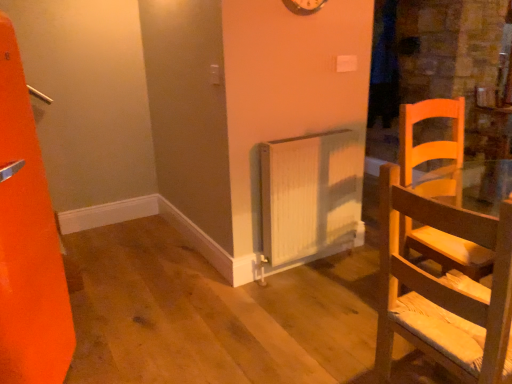
Question: Does white ribbed radiator at center have a lesser height compared to light wood chair at right?

Choices:
 (A) yes
 (B) no

Answer: (A)

Question: Is white ribbed radiator at center bigger than light wood chair at right?

Choices:
 (A) yes
 (B) no

Answer: (B)

Question: Does white ribbed radiator at center appear on the right side of light wood chair at right?

Choices:
 (A) no
 (B) yes

Answer: (A)

Question: Is white ribbed radiator at center not inside light wood chair at right?

Choices:
 (A) no
 (B) yes

Answer: (B)

Question: Can you confirm if white ribbed radiator at center is thinner than light wood chair at right?

Choices:
 (A) no
 (B) yes

Answer: (B)

Question: Is light wood chair at right taller or shorter than white ribbed radiator at center?

Choices:
 (A) short
 (B) tall

Answer: (B)

Question: Does point (493, 342) appear closer or farther from the camera than point (309, 228)?

Choices:
 (A) closer
 (B) farther

Answer: (A)

Question: In terms of width, does light wood chair at right look wider or thinner when compared to white ribbed radiator at center?

Choices:
 (A) thin
 (B) wide

Answer: (B)

Question: From the image's perspective, is light wood chair at right positioned above or below white ribbed radiator at center?

Choices:
 (A) below
 (B) above

Answer: (A)

Question: Is metallic silver clock at upper center taller or shorter than light wood chair at right?

Choices:
 (A) short
 (B) tall

Answer: (A)

Question: From the image's perspective, relative to light wood chair at right, is metallic silver clock at upper center above or below?

Choices:
 (A) above
 (B) below

Answer: (A)

Question: Is metallic silver clock at upper center wider or thinner than light wood chair at right?

Choices:
 (A) thin
 (B) wide

Answer: (A)

Question: Is metallic silver clock at upper center in front of or behind light wood chair at right in the image?

Choices:
 (A) front
 (B) behind

Answer: (B)

Question: In terms of width, does white ribbed radiator at center look wider or thinner when compared to metallic silver clock at upper center?

Choices:
 (A) wide
 (B) thin

Answer: (A)

Question: From a real-world perspective, is white ribbed radiator at center positioned above or below metallic silver clock at upper center?

Choices:
 (A) above
 (B) below

Answer: (B)